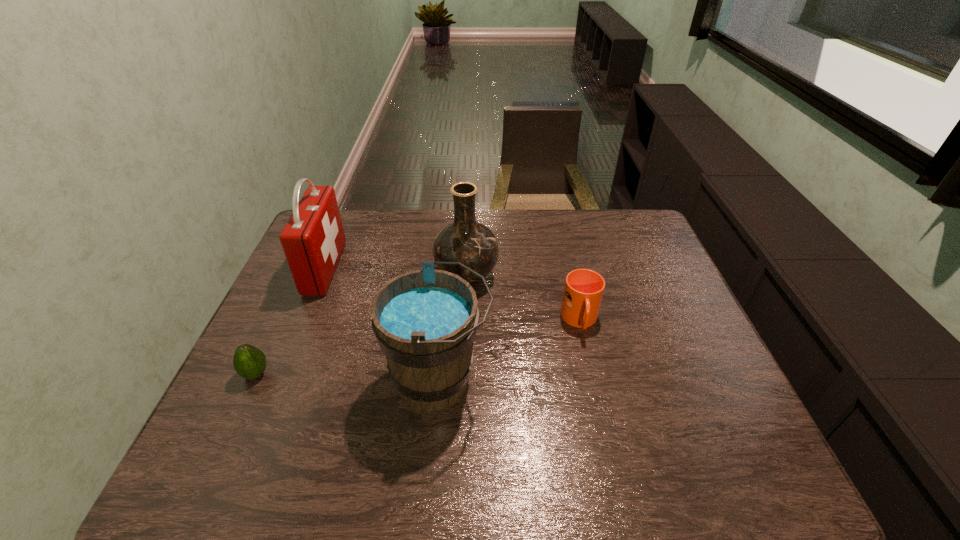
Find the location of a particular element. The width and height of the screenshot is (960, 540). unoccupied position between the first-aid kit and the vase is located at coordinates (396, 272).

At what (x,y) coordinates should I click in order to perform the action: click on empty location between the first-aid kit and the avocado. Please return your answer as a coordinate pair (x, y). Looking at the image, I should click on (291, 321).

I want to click on vacant area between the wine bucket and the avocado, so click(348, 377).

Where is `free space between the wine bucket and the shortest object`? The height and width of the screenshot is (540, 960). free space between the wine bucket and the shortest object is located at coordinates (348, 377).

Image resolution: width=960 pixels, height=540 pixels. In order to click on blank region between the vase and the mug in this screenshot , I will do `click(523, 298)`.

Identify the location of unoccupied area between the wine bucket and the avocado. This screenshot has height=540, width=960. (348, 377).

Point out which object is positioned as the third nearest to the wine bucket. Please provide its 2D coordinates. Your answer should be formatted as a tuple, i.e. [(x, y)], where the tuple contains the x and y coordinates of a point satisfying the conditions above.

[(313, 239)]

At what (x,y) coordinates should I click in order to perform the action: click on object that stands as the fourth closest to the first-aid kit. Please return your answer as a coordinate pair (x, y). Looking at the image, I should click on (583, 291).

Locate an element on the screen. vacant area in the image that satisfies the following two spatial constraints: 1. on the front face of the first-aid kit; 2. on the right side of the vase is located at coordinates (322, 275).

Identify the location of free point that satisfies the following two spatial constraints: 1. on the front side of the vase; 2. with a handle on the side of the wine bucket. This screenshot has height=540, width=960. (463, 380).